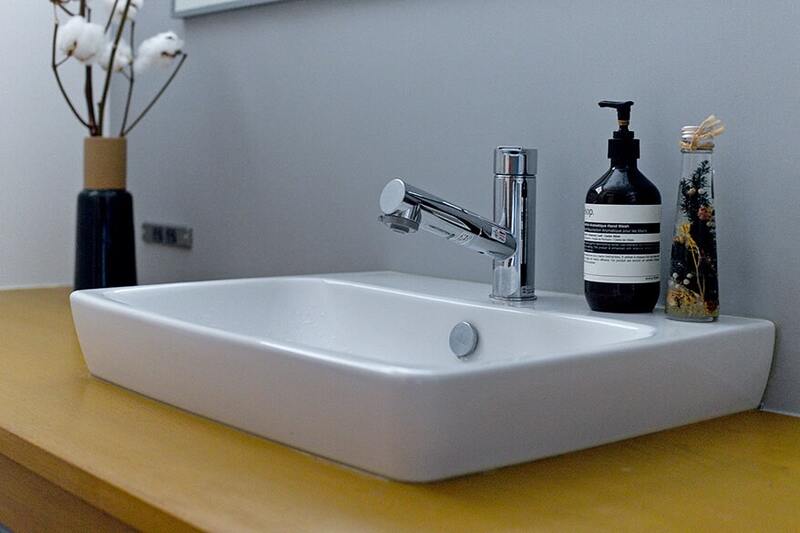
Where is `drawer`? This screenshot has width=800, height=533. drawer is located at coordinates (152, 469).